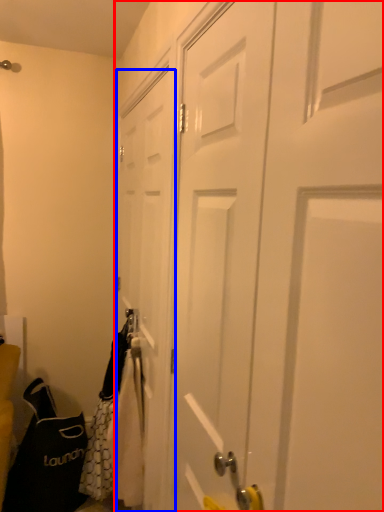
Question: Which point is further to the camera, door (highlighted by a red box) or door (highlighted by a blue box)?

Choices:
 (A) door
 (B) door

Answer: (B)